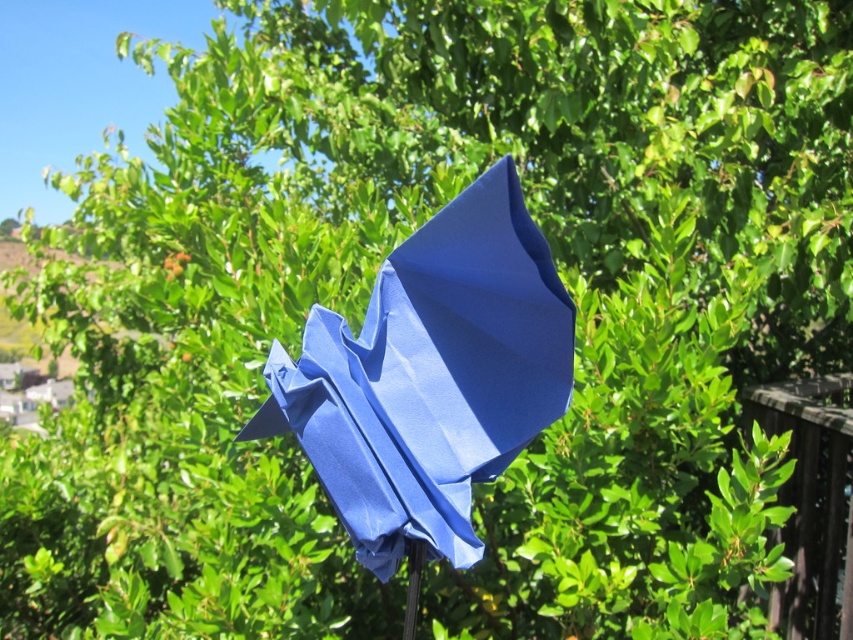
Question: Can you confirm if matte blue umbrella at center is thinner than brown wooden fence at right?

Choices:
 (A) yes
 (B) no

Answer: (A)

Question: Which point is farther to the camera?

Choices:
 (A) (805, 532)
 (B) (320, 440)
 (C) (410, 557)

Answer: (A)

Question: In this image, where is matte blue umbrella at center located relative to metallic silver pole at lower center?

Choices:
 (A) above
 (B) below

Answer: (A)

Question: Based on their relative distances, which object is nearer to the metallic silver pole at lower center?

Choices:
 (A) matte blue umbrella at center
 (B) brown wooden fence at right

Answer: (A)

Question: Is matte blue umbrella at center in front of metallic silver pole at lower center?

Choices:
 (A) no
 (B) yes

Answer: (B)

Question: Which point is farther to the camera?

Choices:
 (A) brown wooden fence at right
 (B) metallic silver pole at lower center

Answer: (A)